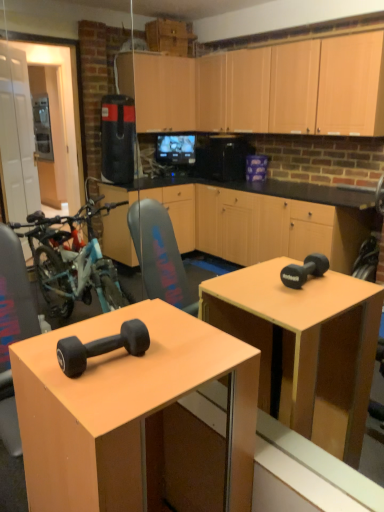
This screenshot has width=384, height=512. Find the location of `empty space that is ontop of matte black dumbbell at center (from a real-world perspective)`. empty space that is ontop of matte black dumbbell at center (from a real-world perspective) is located at coordinates (130, 355).